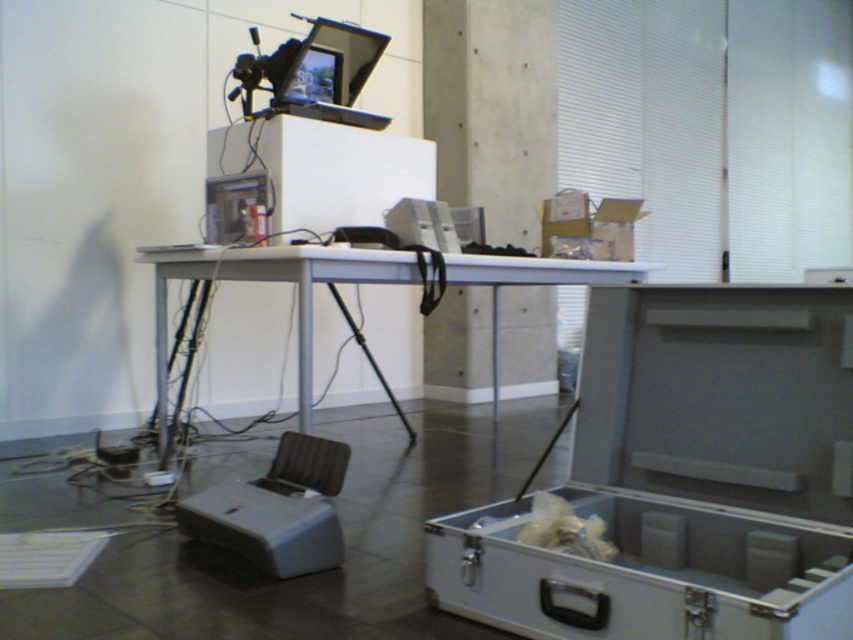
Can you confirm if metallic gray cooler at lower right is positioned to the right of white plastic table at center?

Yes, metallic gray cooler at lower right is to the right of white plastic table at center.

Is metallic gray cooler at lower right thinner than white plastic table at center?

Indeed, metallic gray cooler at lower right has a lesser width compared to white plastic table at center.

Is point (614, 396) less distant than point (173, 266)?

Yes, point (614, 396) is closer to viewer.

Image resolution: width=853 pixels, height=640 pixels. In order to click on metallic gray cooler at lower right in this screenshot , I will do `click(685, 477)`.